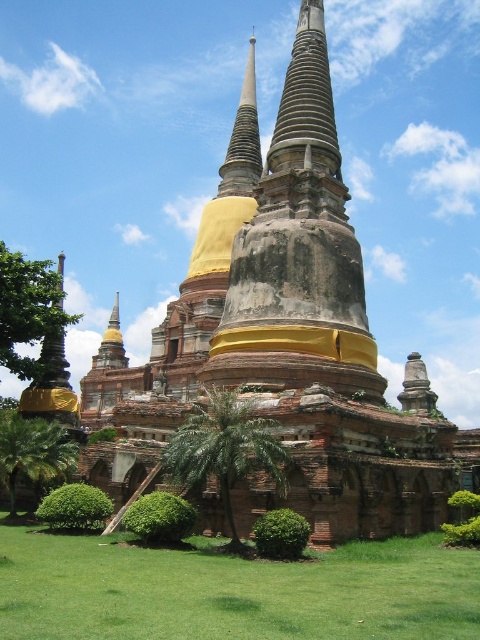
Does green grass at lower center have a lesser width compared to green leafy tree at left?

Incorrect, green grass at lower center's width is not less than green leafy tree at left's.

Consider the image. Who is lower down, green grass at lower center or green leafy tree at left?

green grass at lower center is lower down.

Who is more forward, (x=99, y=536) or (x=14, y=257)?

Point (x=99, y=536)

I want to click on green grass at lower center, so click(233, 589).

Does yellow stone pagoda at center have a greater height compared to green grass at lower center?

Correct, yellow stone pagoda at center is much taller as green grass at lower center.

Based on the photo, can you confirm if yellow stone pagoda at center is bigger than green grass at lower center?

Correct, yellow stone pagoda at center is larger in size than green grass at lower center.

Identify the location of yellow stone pagoda at center. (285, 346).

Can you confirm if yellow stone pagoda at center is positioned to the left of green leafy palm at center?

In fact, yellow stone pagoda at center is to the right of green leafy palm at center.

Can you confirm if yellow stone pagoda at center is smaller than green leafy palm at center?

Incorrect, yellow stone pagoda at center is not smaller in size than green leafy palm at center.

Who is more forward, (317, 112) or (271, 452)?

Positioned in front is point (271, 452).

The width and height of the screenshot is (480, 640). I want to click on yellow stone pagoda at center, so [x=285, y=346].